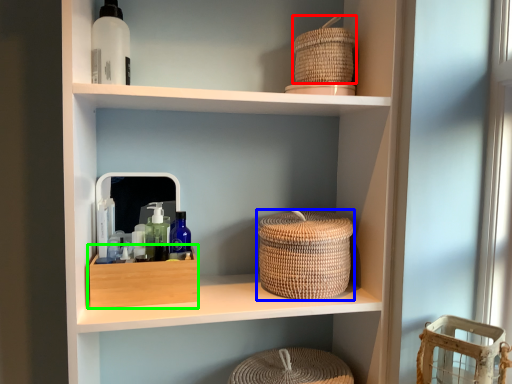
Question: Which object is the closest to the basket (highlighted by a red box)? Choose among these: basket (highlighted by a blue box) or storage box (highlighted by a green box).

Choices:
 (A) basket
 (B) storage box

Answer: (A)